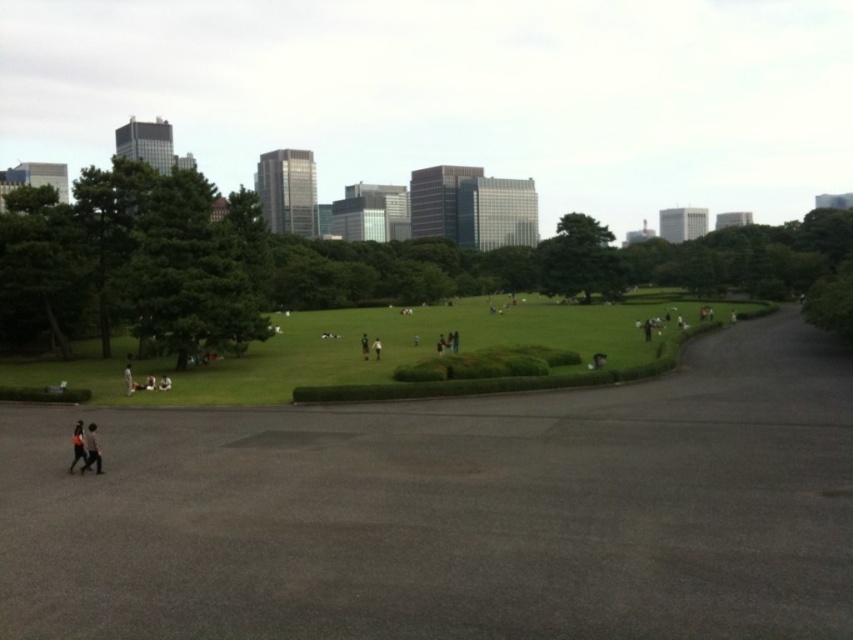
Question: Among these objects, which one is nearest to the camera?

Choices:
 (A) white fabric person at lower left
 (B) black fabric person at center
 (C) green grass at center
 (D) dark gray jacket at lower left

Answer: (D)

Question: Which object is positioned closest to the dark brown leather jacket at center?

Choices:
 (A) dark asphalt path at center
 (B) black fabric person at center
 (C) dark gray fabric pants at lower left

Answer: (B)

Question: Is green grass at center bigger than dark gray fabric pants at lower left?

Choices:
 (A) no
 (B) yes

Answer: (B)

Question: Is dark asphalt path at center positioned before dark gray fabric pants at lower left?

Choices:
 (A) no
 (B) yes

Answer: (B)

Question: Which object is positioned closest to the dark asphalt path at center?

Choices:
 (A) dark gray jacket at lower left
 (B) green grass at center
 (C) white fabric person at lower left

Answer: (A)

Question: Can you confirm if green grass at center is smaller than dark gray fabric pants at lower left?

Choices:
 (A) yes
 (B) no

Answer: (B)